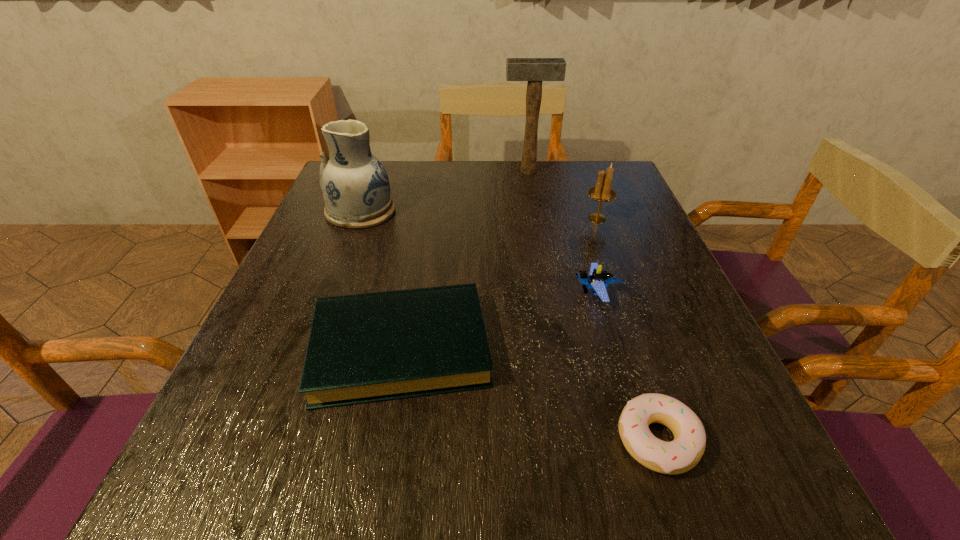
Locate an element on the screen. free spot between the book and the third tallest object is located at coordinates (499, 284).

The image size is (960, 540). Find the location of `free spot between the doughnut and the mallet`. free spot between the doughnut and the mallet is located at coordinates (592, 306).

I want to click on vacant area that lies between the doughnut and the farthest object, so click(x=592, y=306).

Where is `free area in between the tallest object and the doughnut`? Image resolution: width=960 pixels, height=540 pixels. free area in between the tallest object and the doughnut is located at coordinates (592, 306).

The height and width of the screenshot is (540, 960). Find the location of `free point between the book and the mallet`. free point between the book and the mallet is located at coordinates tap(465, 260).

Identify the location of empty location between the fourth tallest object and the book. (498, 321).

At what (x,y) coordinates should I click in order to perform the action: click on free spot between the candle holder and the second tallest object. Please return your answer as a coordinate pair (x, y). The image size is (960, 540). Looking at the image, I should click on (479, 214).

You are a GUI agent. You are given a task and a screenshot of the screen. Output one action in this format:
    pyautogui.click(x=<x>, y=<y>)
    Task: Click on the free spot between the book and the pottery
    
    Given the screenshot: What is the action you would take?
    pyautogui.click(x=381, y=279)

I want to click on unoccupied area between the Lego and the pottery, so click(478, 252).

Image resolution: width=960 pixels, height=540 pixels. In order to click on free space between the doughnut and the third tallest object in this screenshot , I will do [628, 329].